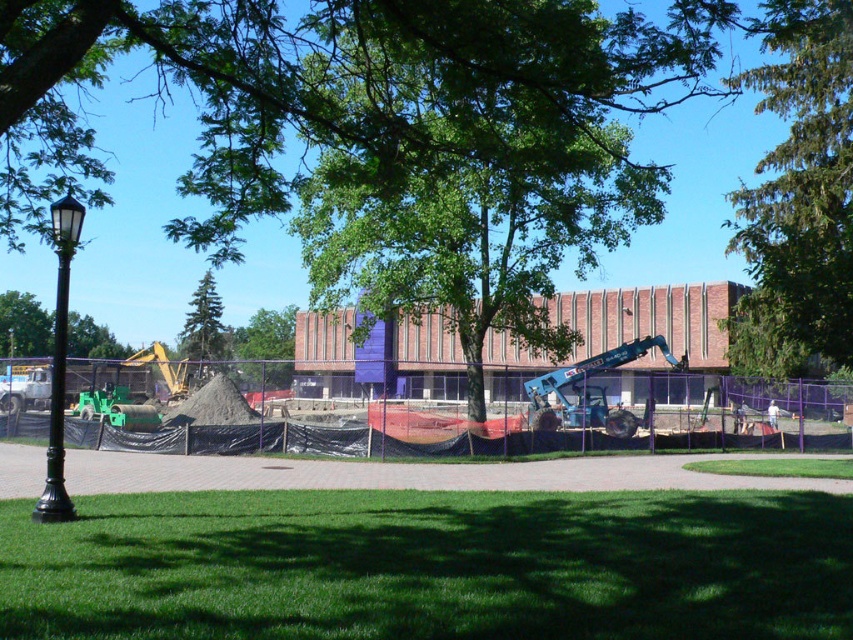
You are standing at the construction site and want to reach a specific point marked at coordinates point (x=57, y=400). If your current position is 10 meters away from that point, can you safely walk towards it without crossing any obstacles?

The distance of point (x=57, y=400) from viewer is 11.45 meters. Since you are currently 10 meters away from it, you are still 1.45 meters away from reaching the point. However, the question mentions obstacles, but the provided scene description does not mention any obstacles between your current position and the target point. Therefore, assuming there are no obstacles, you can safely walk towards it.

You are standing at the construction site and want to take a photo of the green leafy tree at upper center. If your camera has a maximum focus range of 8 meters, will you need to move closer to capture it clearly?

The green leafy tree at upper center is 8.63 meters away from the viewer. Since the camera can only focus up to 8 meters, you need to move closer to ensure it is within the 8 meter range for clear focus.

You are standing at the construction site and want to determine the relative positions of two points marked in the image. Which point is closer to you, point (59, 212) or point (250, 384)?

Point (59, 212) is closer to the viewer than point (250, 384).